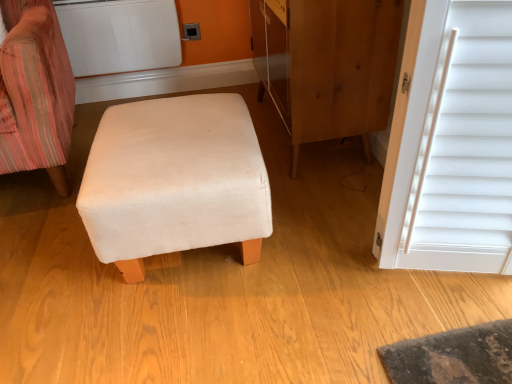
Question: From a real-world perspective, is velvet striped chair at left physically below wooden dresser at center?

Choices:
 (A) no
 (B) yes

Answer: (A)

Question: Is velvet striped chair at left at the right side of wooden dresser at center?

Choices:
 (A) yes
 (B) no

Answer: (B)

Question: Does velvet striped chair at left appear on the left side of wooden dresser at center?

Choices:
 (A) no
 (B) yes

Answer: (B)

Question: From the image's perspective, does velvet striped chair at left appear lower than wooden dresser at center?

Choices:
 (A) no
 (B) yes

Answer: (B)

Question: Is velvet striped chair at left oriented away from wooden dresser at center?

Choices:
 (A) no
 (B) yes

Answer: (A)

Question: Considering the relative positions of beige fabric ottoman at center and matte plastic outlet at upper center in the image provided, is beige fabric ottoman at center to the left or to the right of matte plastic outlet at upper center?

Choices:
 (A) left
 (B) right

Answer: (B)

Question: Is beige fabric ottoman at center taller or shorter than matte plastic outlet at upper center?

Choices:
 (A) short
 (B) tall

Answer: (B)

Question: Looking at their shapes, would you say beige fabric ottoman at center is wider or thinner than matte plastic outlet at upper center?

Choices:
 (A) wide
 (B) thin

Answer: (A)

Question: From a real-world perspective, is beige fabric ottoman at center above or below matte plastic outlet at upper center?

Choices:
 (A) above
 (B) below

Answer: (B)

Question: Would you say wooden dresser at center is to the left or to the right of beige fabric ottoman at center in the picture?

Choices:
 (A) left
 (B) right

Answer: (B)

Question: In terms of size, does wooden dresser at center appear bigger or smaller than beige fabric ottoman at center?

Choices:
 (A) big
 (B) small

Answer: (A)

Question: Considering the positions of point (352, 33) and point (206, 135), is point (352, 33) closer or farther from the camera than point (206, 135)?

Choices:
 (A) farther
 (B) closer

Answer: (A)

Question: Looking at their shapes, would you say wooden dresser at center is wider or thinner than beige fabric ottoman at center?

Choices:
 (A) wide
 (B) thin

Answer: (B)

Question: Is velvet striped chair at left bigger or smaller than beige fabric ottoman at center?

Choices:
 (A) small
 (B) big

Answer: (B)

Question: In the image, is velvet striped chair at left on the left side or the right side of beige fabric ottoman at center?

Choices:
 (A) right
 (B) left

Answer: (B)